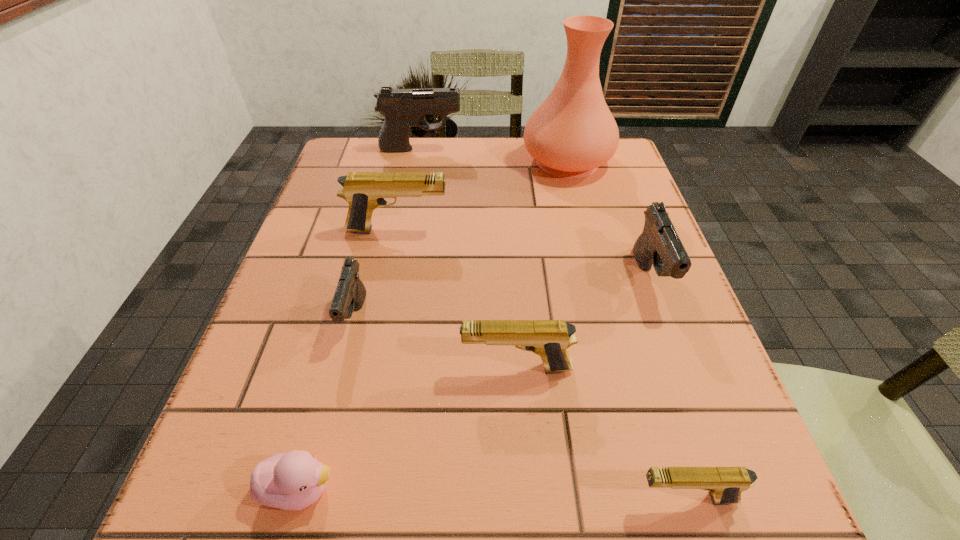
Locate an element on the screen. The height and width of the screenshot is (540, 960). object that is at the far left corner is located at coordinates (402, 108).

You are a GUI agent. You are given a task and a screenshot of the screen. Output one action in this format:
    pyautogui.click(x=<x>, y=<y>)
    Task: Click on the object situated at the near left corner
    The image size is (960, 540).
    Given the screenshot: What is the action you would take?
    point(289,481)

Find the location of a particular element. object at the far right corner is located at coordinates (572, 133).

Image resolution: width=960 pixels, height=540 pixels. In order to click on object at the near right corner in this screenshot , I will do `click(725, 484)`.

In the image, there is a desktop. At what (x,y) coordinates should I click in order to perform the action: click on free space at the far edge. Please return your answer as a coordinate pair (x, y). Looking at the image, I should click on (484, 141).

Identify the location of vacant space at the near edge of the desktop. Image resolution: width=960 pixels, height=540 pixels. (462, 519).

The height and width of the screenshot is (540, 960). Find the location of `free space at the left edge`. free space at the left edge is located at coordinates (294, 400).

This screenshot has width=960, height=540. Identify the location of vacant space at the right edge of the desktop. (645, 440).

Where is `vacant space at the near left corner`? vacant space at the near left corner is located at coordinates (208, 502).

Locate an element on the screen. The height and width of the screenshot is (540, 960). vacant space at the far right corner of the desktop is located at coordinates (602, 165).